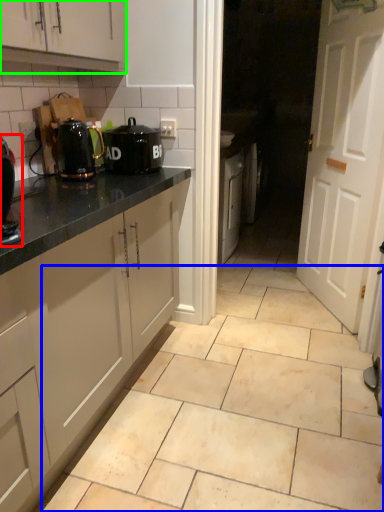
Question: Considering the real-world distances, which object is farthest from coffee machine (highlighted by a red box)? ceramic tile (highlighted by a blue box) or cabinetry (highlighted by a green box)?

Choices:
 (A) ceramic tile
 (B) cabinetry

Answer: (A)